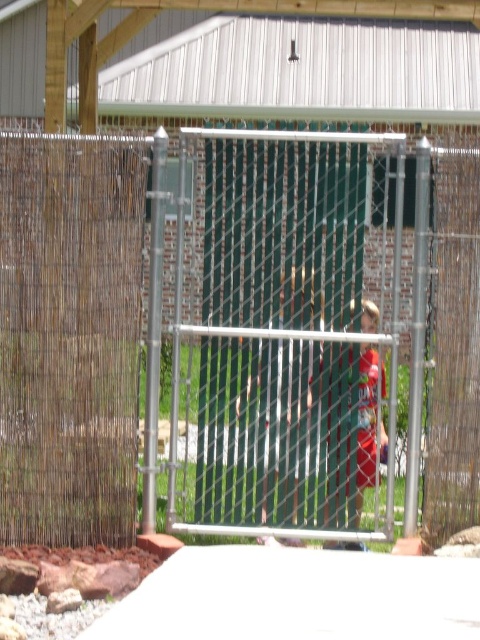
Between brown woven mat at left and red cotton shirt at center, which one appears on the left side from the viewer's perspective?

From the viewer's perspective, brown woven mat at left appears more on the left side.

The height and width of the screenshot is (640, 480). I want to click on brown woven mat at left, so click(236, 330).